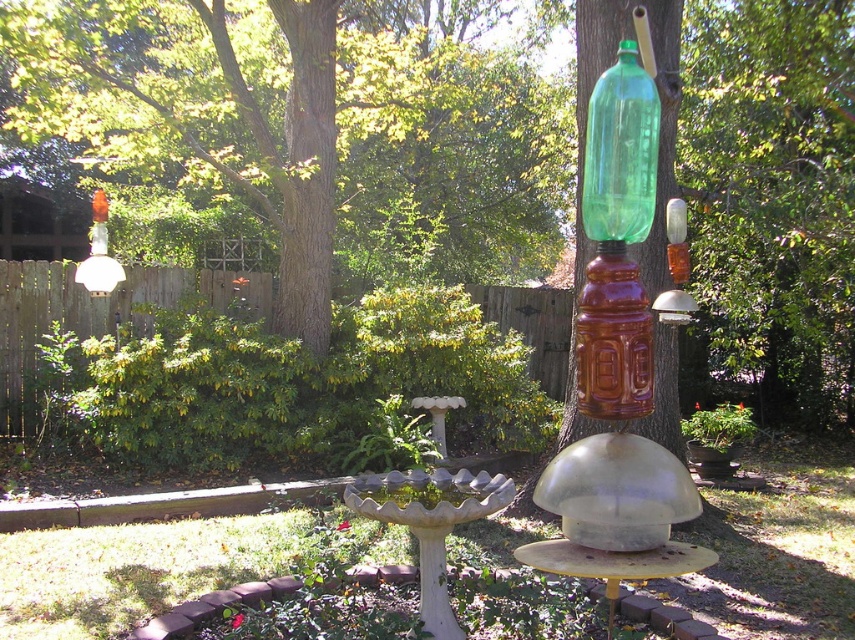
Question: Is green leafy tree at upper left wider than green glass bottle at upper center?

Choices:
 (A) yes
 (B) no

Answer: (A)

Question: Is green leafy tree at upper left thinner than green glass bottle at upper center?

Choices:
 (A) yes
 (B) no

Answer: (B)

Question: Is green leafy tree at upper left thinner than green glass bottle at upper center?

Choices:
 (A) no
 (B) yes

Answer: (A)

Question: Which point is closer to the camera taking this photo?

Choices:
 (A) (240, 65)
 (B) (640, 161)

Answer: (B)

Question: Which point is farther to the camera?

Choices:
 (A) green leafy tree at upper left
 (B) green glass bottle at upper center

Answer: (A)

Question: Which point appears farthest from the camera in this image?

Choices:
 (A) (331, 3)
 (B) (620, 228)

Answer: (A)